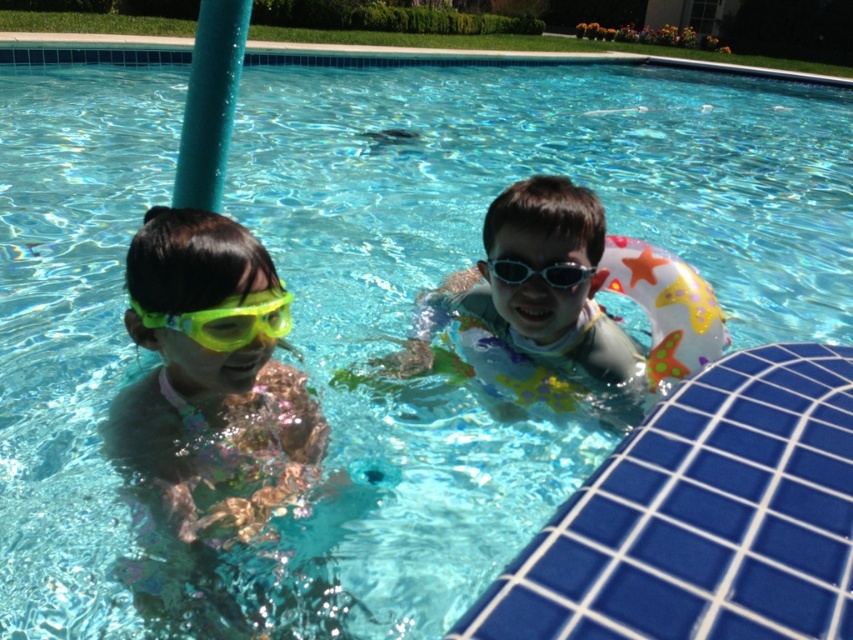
Question: Which object is farther from the camera taking this photo?

Choices:
 (A) yellow-green plastic goggles at left
 (B) translucent rubber ring at center
 (C) neon yellow goggles at left

Answer: (B)

Question: Can you confirm if neon yellow goggles at left is positioned to the left of translucent rubber ring at center?

Choices:
 (A) yes
 (B) no

Answer: (A)

Question: Which of the following is the farthest from the observer?

Choices:
 (A) (503, 262)
 (B) (173, 314)
 (C) (152, 317)
 (D) (604, 314)

Answer: (D)

Question: Which point is closer to the camera taking this photo?

Choices:
 (A) (310, 445)
 (B) (537, 205)
 (C) (587, 276)

Answer: (A)

Question: In this image, where is yellow-green plastic goggles at left located relative to transparent plastic goggles at center?

Choices:
 (A) below
 (B) above

Answer: (A)

Question: Does yellow-green plastic goggles at left appear on the left side of transparent plastic goggles at center?

Choices:
 (A) yes
 (B) no

Answer: (A)